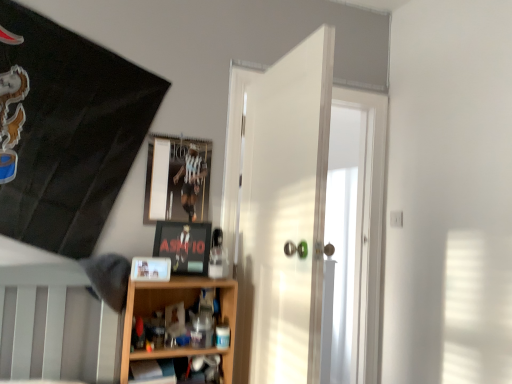
Question: Does metallic reflective frame at upper center, which is the first picture frame from back to front, appear on the left side of wooden shelf at lower center, the 2th shelf when ordered from bottom to top?

Choices:
 (A) yes
 (B) no

Answer: (A)

Question: Considering the relative sizes of metallic reflective frame at upper center, which is the first picture frame from back to front, and wooden shelf at lower center, the 2th shelf when ordered from bottom to top, in the image provided, is metallic reflective frame at upper center, which is the first picture frame from back to front, shorter than wooden shelf at lower center, the 2th shelf when ordered from bottom to top,?

Choices:
 (A) no
 (B) yes

Answer: (B)

Question: From a real-world perspective, is metallic reflective frame at upper center, which appears as the 1th picture frame when viewed from the top, physically below wooden shelf at lower center, the 2th shelf when ordered from bottom to top?

Choices:
 (A) no
 (B) yes

Answer: (A)

Question: Is metallic reflective frame at upper center, which appears as the 1th picture frame when viewed from the top, surrounding wooden shelf at lower center, which ranks as the first shelf in top-to-bottom order?

Choices:
 (A) yes
 (B) no

Answer: (B)

Question: From a real-world perspective, is metallic reflective frame at upper center, marked as the 3th picture frame in a bottom-to-top arrangement, located higher than wooden shelf at lower center, the 2th shelf when ordered from bottom to top?

Choices:
 (A) yes
 (B) no

Answer: (A)

Question: From the image's perspective, would you say metallic reflective frame at upper center, marked as the 3th picture frame in a bottom-to-top arrangement, is positioned over wooden shelf at lower center, the 2th shelf when ordered from bottom to top?

Choices:
 (A) no
 (B) yes

Answer: (B)

Question: Is wooden shelf at lower center, which ranks as the first shelf in top-to-bottom order, positioned beyond the bounds of metallic reflective frame at upper center, which appears as the 1th picture frame when viewed from the top?

Choices:
 (A) no
 (B) yes

Answer: (B)

Question: Considering the relative sizes of wooden shelf at lower center, which ranks as the first shelf in top-to-bottom order, and metallic reflective frame at upper center, which is the first picture frame from back to front, in the image provided, is wooden shelf at lower center, which ranks as the first shelf in top-to-bottom order, wider than metallic reflective frame at upper center, which is the first picture frame from back to front,?

Choices:
 (A) no
 (B) yes

Answer: (B)

Question: From a real-world perspective, is wooden shelf at lower center, which ranks as the first shelf in top-to-bottom order, beneath metallic reflective frame at upper center, marked as the 3th picture frame in a bottom-to-top arrangement?

Choices:
 (A) yes
 (B) no

Answer: (A)

Question: From a real-world perspective, is wooden shelf at lower center, the 2th shelf when ordered from bottom to top, located higher than metallic reflective frame at upper center, marked as the 3th picture frame in a bottom-to-top arrangement?

Choices:
 (A) no
 (B) yes

Answer: (A)

Question: Is wooden shelf at lower center, the 2th shelf when ordered from bottom to top, thinner than metallic reflective frame at upper center, which is the first picture frame from back to front?

Choices:
 (A) yes
 (B) no

Answer: (B)

Question: Does wooden shelf at lower center, which ranks as the first shelf in top-to-bottom order, lie in front of metallic reflective frame at upper center, positioned as the third picture frame in front-to-back order?

Choices:
 (A) yes
 (B) no

Answer: (A)

Question: Can you confirm if wooden shelf at lower center, which ranks as the first shelf in top-to-bottom order, is smaller than matte black picture frame at center, which is the 2th picture frame in front-to-back order?

Choices:
 (A) yes
 (B) no

Answer: (B)